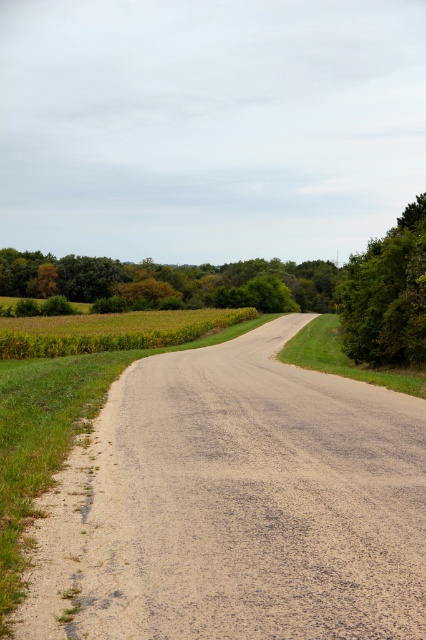
Based on the photo, you are driving a car that is 5 meters long. You see the dull gray asphalt road at center and the green leafy tree at right. Can your car fit entirely between them without crossing into either side?

The distance between the dull gray asphalt road at center and the green leafy tree at right is 14.94 meters. Since your car is only 5 meters long, it can easily fit entirely between them without crossing into either side.